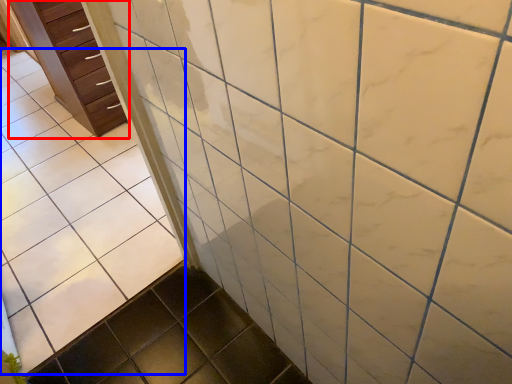
Question: Among these objects, which one is nearest to the camera, chest of drawers (highlighted by a red box) or ceramic tile (highlighted by a blue box)?

Choices:
 (A) chest of drawers
 (B) ceramic tile

Answer: (B)